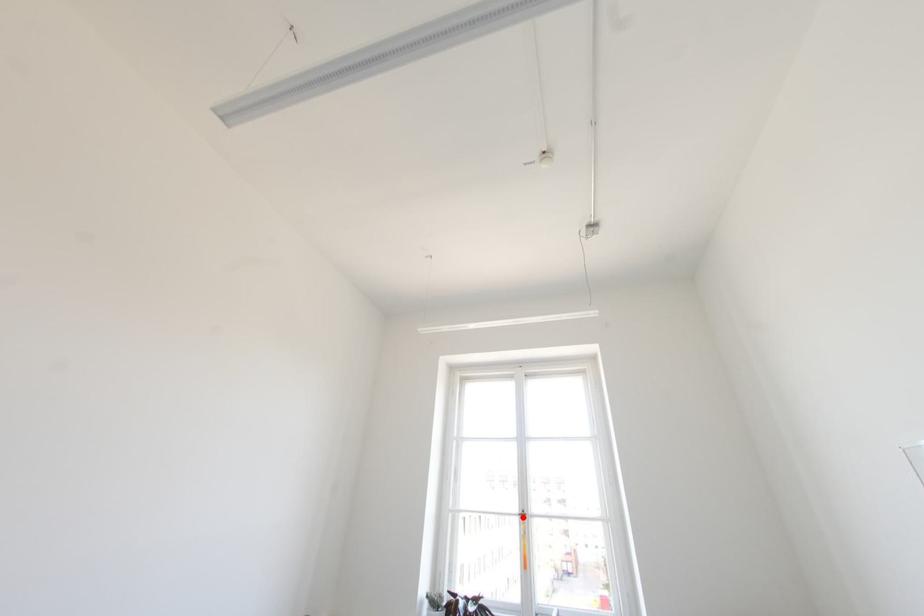
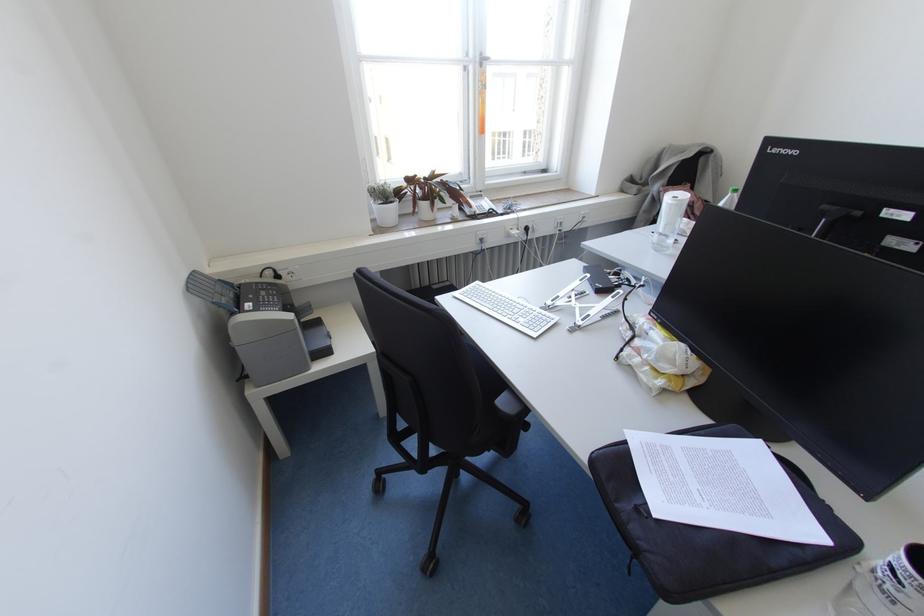
Locate, in the second image, the point that corresponds to the highlighted location in the first image.

(480, 65)